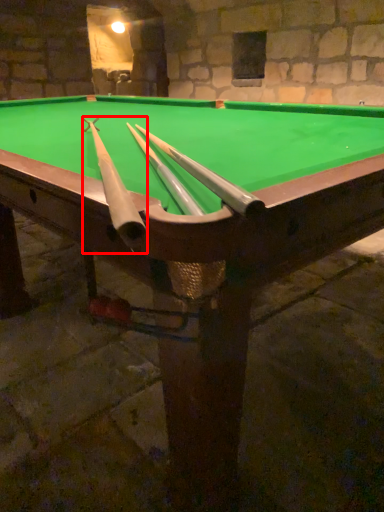
Question: From the image's perspective, considering the relative positions of cue (annotated by the red box) and cue in the image provided, where is cue (annotated by the red box) located with respect to the staircase?

Choices:
 (A) above
 (B) below

Answer: (B)